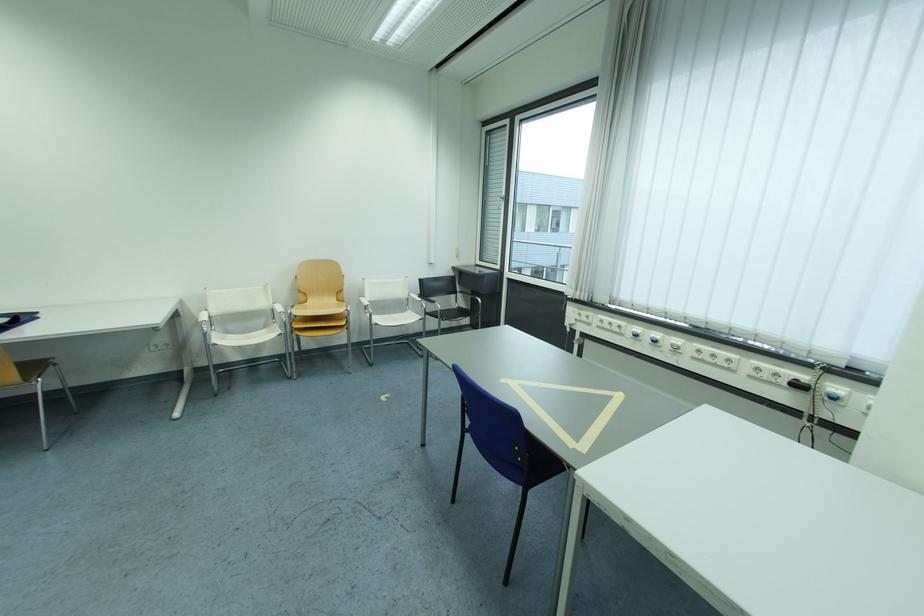
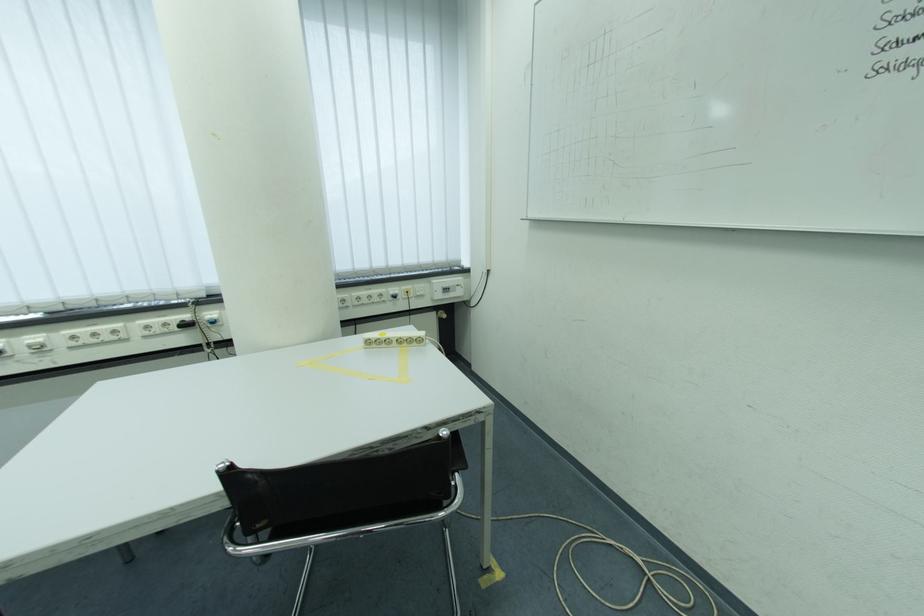
Locate, in the second image, the point that corresponds to (x=843, y=400) in the first image.

(223, 325)